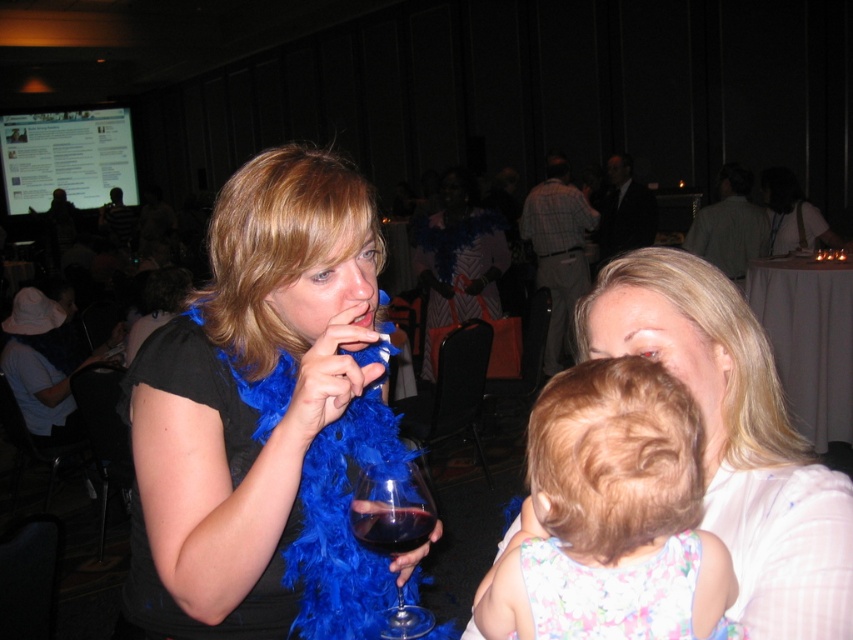
In the scene shown: Based on the scene description, which object is bigger between the blue feather boa at center and the smooth white blouse at center?

The blue feather boa at center has a larger size compared to the smooth white blouse at center.

You are a photographer at the event and want to capture a clear shot of the smooth white blouse at center without the blue feather boa at center blocking it. What should you do?

The smooth white blouse at center is behind the blue feather boa at center, so you should move your position to angle the camera around the blue feather boa at center to get a clear view of the smooth white blouse at center.